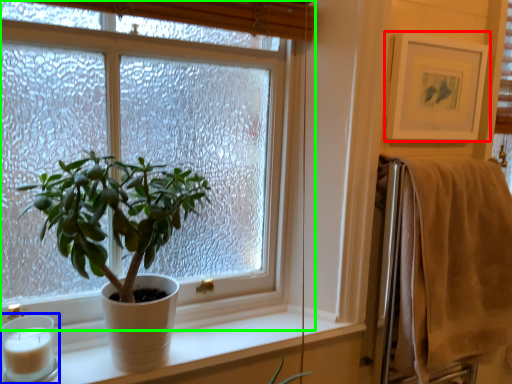
Question: Which object is positioned farthest from picture frame (highlighted by a red box)? Select from candle holder (highlighted by a blue box) and window (highlighted by a green box).

Choices:
 (A) candle holder
 (B) window

Answer: (A)